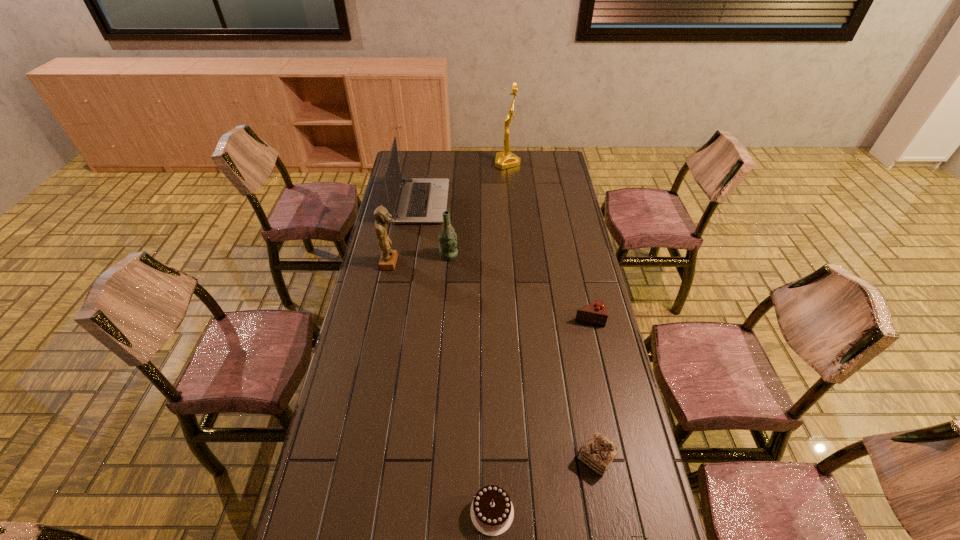
The image size is (960, 540). Identify the location of unoccupied area between the nearest chocolate cake and the third nearest object. (544, 485).

Identify which object is the seventh nearest to the second farthest object. Please provide its 2D coordinates. Your answer should be formatted as a tuple, i.e. [(x, y)], where the tuple contains the x and y coordinates of a point satisfying the conditions above.

[(591, 539)]

Select which object is the fourth closest to the figurine. Please provide its 2D coordinates. Your answer should be formatted as a tuple, i.e. [(x, y)], where the tuple contains the x and y coordinates of a point satisfying the conditions above.

[(506, 159)]

Locate an element on the screen. This screenshot has width=960, height=540. chocolate cake that is the second closest one to the sunglasses is located at coordinates 492,512.

The width and height of the screenshot is (960, 540). I want to click on chocolate cake that is the closest to the beer bottle, so click(596, 313).

Identify the location of vacant space that satisfies the following two spatial constraints: 1. on the front-facing side of the figurine; 2. on the back side of the farthest chocolate cake. (378, 319).

The height and width of the screenshot is (540, 960). What are the coordinates of `vacant space that satisfies the following two spatial constraints: 1. on the screen of the nearest chocolate cake; 2. on the left side of the laptop computer` in the screenshot? It's located at 372,512.

Where is `vacant point that satisfies the following two spatial constraints: 1. on the back side of the second farthest chocolate cake; 2. on the front-facing side of the tallest object`? vacant point that satisfies the following two spatial constraints: 1. on the back side of the second farthest chocolate cake; 2. on the front-facing side of the tallest object is located at coordinates (541, 163).